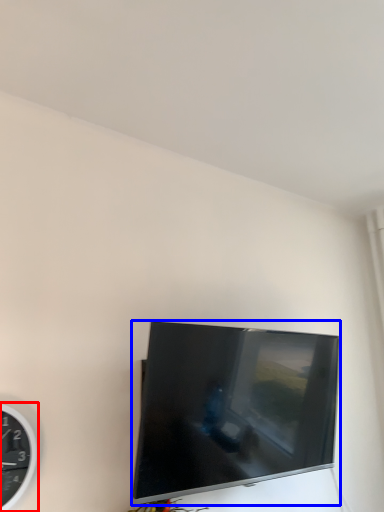
Question: Which of the following is the closest to the observer, wall clock (highlighted by a red box) or television (highlighted by a blue box)?

Choices:
 (A) wall clock
 (B) television

Answer: (A)